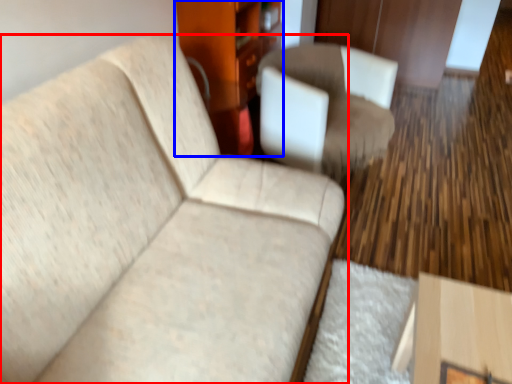
Question: Which object appears farthest to the camera in this image, studio couch (highlighted by a red box) or dresser (highlighted by a blue box)?

Choices:
 (A) studio couch
 (B) dresser

Answer: (B)